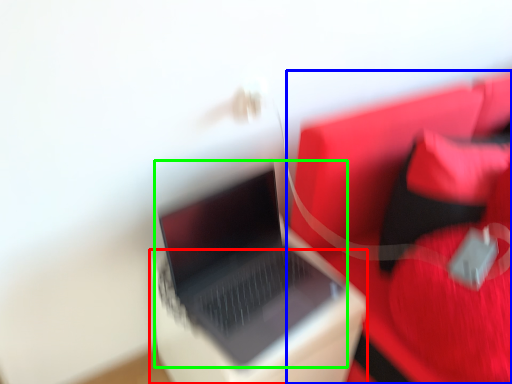
Question: Which is nearer to the cardboard box (highlighted by a red box)? furniture (highlighted by a blue box) or laptop (highlighted by a green box).

Choices:
 (A) furniture
 (B) laptop

Answer: (B)